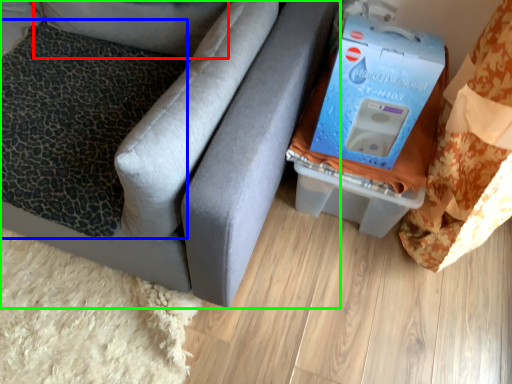
Question: Based on their relative distances, which object is farther from pillow (highlighted by a red box)? Choose from pillow (highlighted by a blue box) and furniture (highlighted by a green box).

Choices:
 (A) pillow
 (B) furniture

Answer: (B)